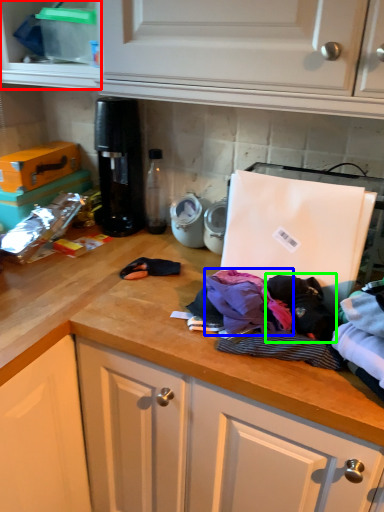
Question: Which object is the farthest from cabinetry (highlighted by a red box)? Choose among these: clothing (highlighted by a blue box) or clothing (highlighted by a green box).

Choices:
 (A) clothing
 (B) clothing

Answer: (B)